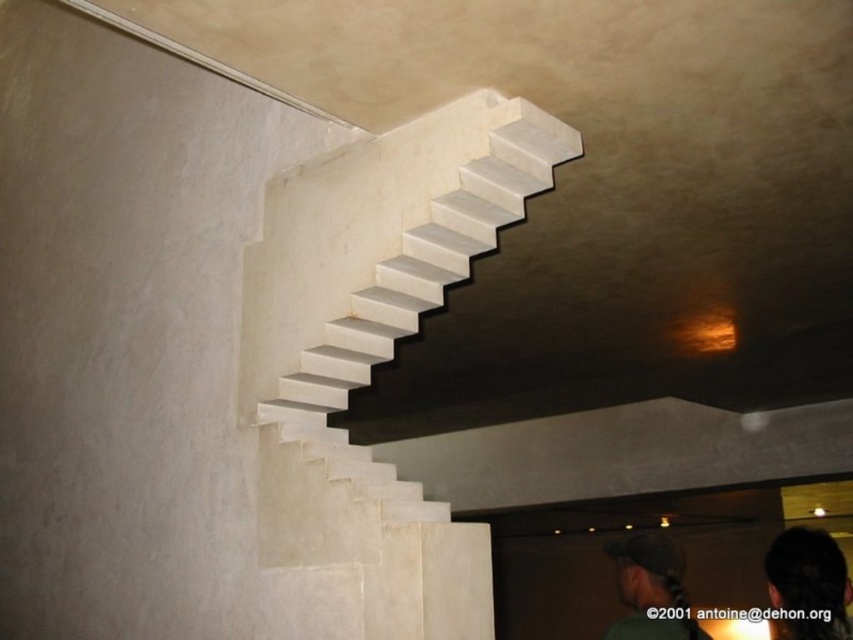
Question: Which point is closer to the camera?

Choices:
 (A) (831, 586)
 (B) (666, 554)
 (C) (254, 355)

Answer: (C)

Question: Considering the real-world distances, which object is farthest from the dark green fabric cap at upper center?

Choices:
 (A) white marble stairs at upper center
 (B) dark hair at lower right

Answer: (A)

Question: Observing the image, what is the correct spatial positioning of dark hair at lower right in reference to dark green fabric cap at upper center?

Choices:
 (A) below
 (B) above

Answer: (B)

Question: Is dark hair at lower right wider than dark green fabric cap at upper center?

Choices:
 (A) no
 (B) yes

Answer: (A)

Question: Is white marble stairs at upper center above dark hair at lower right?

Choices:
 (A) yes
 (B) no

Answer: (A)

Question: Which is farther from the dark hair at lower right?

Choices:
 (A) dark green fabric cap at upper center
 (B) white marble stairs at upper center

Answer: (A)